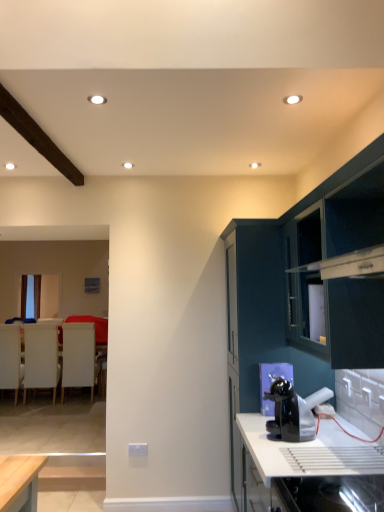
Question: Is the depth of dark green cabinet at upper right, which is counted as the 1th cabinetry, starting from the front, less than that of white matte armchair at left, which is counted as the second armchair, starting from the left?

Choices:
 (A) no
 (B) yes

Answer: (B)

Question: Is dark green cabinet at upper right, which is counted as the 1th cabinetry, starting from the front, further to camera compared to white matte armchair at left, which is counted as the second armchair, starting from the left?

Choices:
 (A) yes
 (B) no

Answer: (B)

Question: Does dark green cabinet at upper right, which is counted as the 1th cabinetry, starting from the front, have a greater height compared to white matte armchair at left, the 2th armchair positioned from the right?

Choices:
 (A) no
 (B) yes

Answer: (A)

Question: From a real-world perspective, does dark green cabinet at upper right, which is counted as the 1th cabinetry, starting from the front, stand above white matte armchair at left, the 2th armchair positioned from the right?

Choices:
 (A) yes
 (B) no

Answer: (A)

Question: Is there a large distance between dark green cabinet at upper right, the second cabinetry viewed from the back, and white matte armchair at left, which is counted as the second armchair, starting from the left?

Choices:
 (A) yes
 (B) no

Answer: (A)

Question: From the image's perspective, relative to dark green cabinet at upper right, the second cabinetry viewed from the back, is white fabric armchair at left, the 1th armchair when ordered from right to left, above or below?

Choices:
 (A) above
 (B) below

Answer: (B)

Question: Is point (76, 377) closer or farther from the camera than point (364, 246)?

Choices:
 (A) closer
 (B) farther

Answer: (B)

Question: From their relative heights in the image, would you say white fabric armchair at left, the 1th armchair when ordered from right to left, is taller or shorter than dark green cabinet at upper right, which is counted as the 1th cabinetry, starting from the front?

Choices:
 (A) short
 (B) tall

Answer: (B)

Question: Considering the positions of white fabric armchair at left, the 1th armchair when ordered from right to left, and dark green cabinet at upper right, the second cabinetry viewed from the back, in the image, is white fabric armchair at left, the 1th armchair when ordered from right to left, wider or thinner than dark green cabinet at upper right, the second cabinetry viewed from the back,?

Choices:
 (A) wide
 (B) thin

Answer: (A)

Question: Considering the positions of black glossy coffee machine at lower center and glossy dark teal cabinet at right, which appears as the 1th cabinetry when viewed from the back, in the image, is black glossy coffee machine at lower center wider or thinner than glossy dark teal cabinet at right, which appears as the 1th cabinetry when viewed from the back,?

Choices:
 (A) thin
 (B) wide

Answer: (A)

Question: Is point (281, 415) positioned closer to the camera than point (354, 301)?

Choices:
 (A) farther
 (B) closer

Answer: (A)

Question: Considering the relative positions of black glossy coffee machine at lower center and glossy dark teal cabinet at right, which appears as the 1th cabinetry when viewed from the back, in the image provided, is black glossy coffee machine at lower center to the left or to the right of glossy dark teal cabinet at right, which appears as the 1th cabinetry when viewed from the back,?

Choices:
 (A) left
 (B) right

Answer: (A)

Question: Relative to glossy dark teal cabinet at right, marked as the second cabinetry in a front-to-back arrangement, is black glossy coffee machine at lower center in front or behind?

Choices:
 (A) front
 (B) behind

Answer: (A)

Question: Considering the positions of point (281, 454) and point (302, 317), is point (281, 454) closer or farther from the camera than point (302, 317)?

Choices:
 (A) closer
 (B) farther

Answer: (A)

Question: Based on their positions, is white glossy countertop at lower right located to the left or right of glossy dark teal cabinet at right, marked as the second cabinetry in a front-to-back arrangement?

Choices:
 (A) left
 (B) right

Answer: (B)